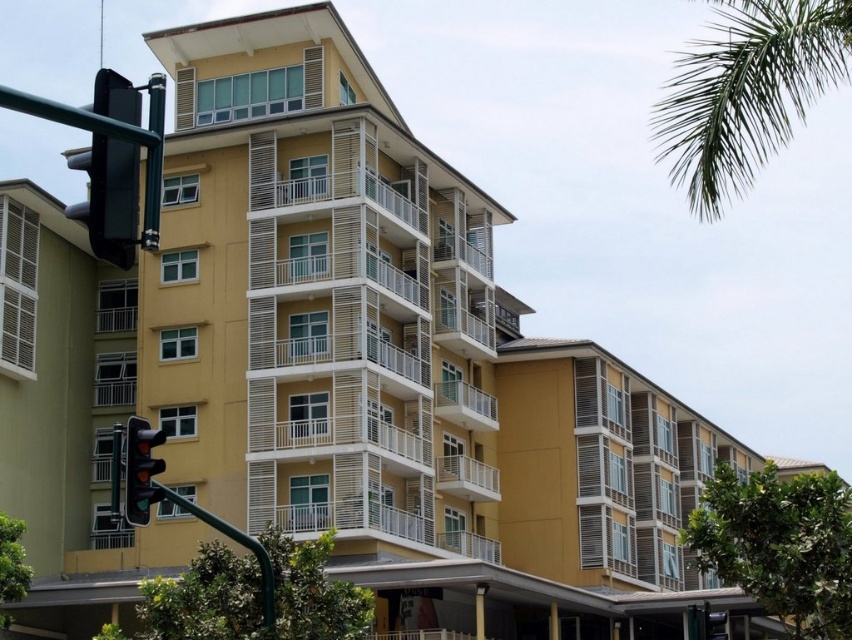
Question: Does black plastic traffic light at left have a smaller size compared to matte black traffic light at left?

Choices:
 (A) no
 (B) yes

Answer: (A)

Question: Which point is farther from the camera taking this photo?

Choices:
 (A) (104, 138)
 (B) (752, 4)

Answer: (B)

Question: Estimate the real-world distances between objects in this image. Which object is farther from the black plastic traffic light at left?

Choices:
 (A) green leafy palm at upper right
 (B) matte black traffic light at left

Answer: (A)

Question: Which object is closer to the camera taking this photo?

Choices:
 (A) green leafy palm at upper right
 (B) black plastic traffic light at left
 (C) matte black traffic light at left

Answer: (B)

Question: Can you confirm if green leafy palm at upper right is positioned to the right of matte black traffic light at left?

Choices:
 (A) no
 (B) yes

Answer: (B)

Question: Does green leafy palm at upper right appear on the right side of matte black traffic light at left?

Choices:
 (A) no
 (B) yes

Answer: (B)